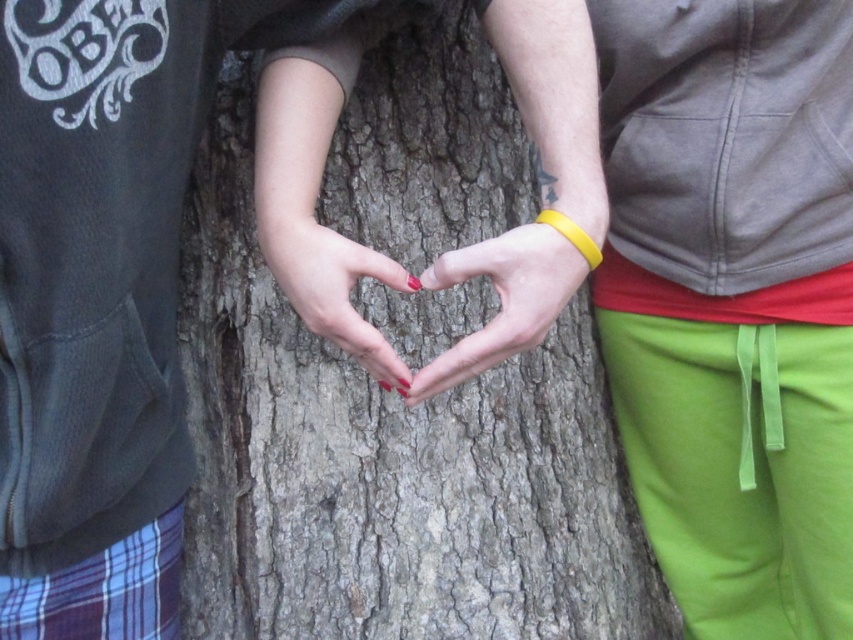
Who is more forward, (601, 516) or (339, 328)?

Point (339, 328) is more forward.

Describe the element at coordinates (387, 464) in the screenshot. The height and width of the screenshot is (640, 853). I see `smooth bark tree trunk at center` at that location.

Does point (230, 120) lie in front of point (366, 273)?

No.

Locate an element on the screen. The height and width of the screenshot is (640, 853). smooth bark tree trunk at center is located at coordinates (387, 464).

Is smooth bark tree trunk at center behind smooth skin heart at center?

Yes.

Can you confirm if smooth bark tree trunk at center is wider than smooth skin heart at center?

Correct, the width of smooth bark tree trunk at center exceeds that of smooth skin heart at center.

Is point (461, 388) behind point (579, 257)?

Yes, point (461, 388) is behind point (579, 257).

What are the coordinates of `smooth bark tree trunk at center` in the screenshot? It's located at (387, 464).

Image resolution: width=853 pixels, height=640 pixels. What do you see at coordinates (502, 300) in the screenshot?
I see `smooth skin heart at center` at bounding box center [502, 300].

Does point (529, 333) come closer to viewer compared to point (398, 278)?

Yes, point (529, 333) is closer to viewer.

Is point (595, 225) farther from viewer compared to point (351, 285)?

That is True.

Identify the location of smooth skin heart at center. The image size is (853, 640). (502, 300).